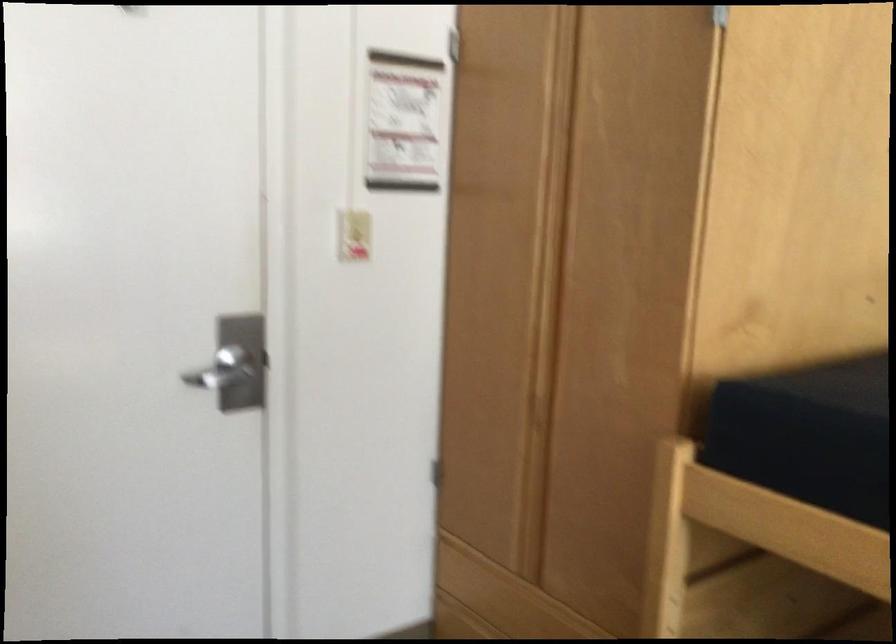
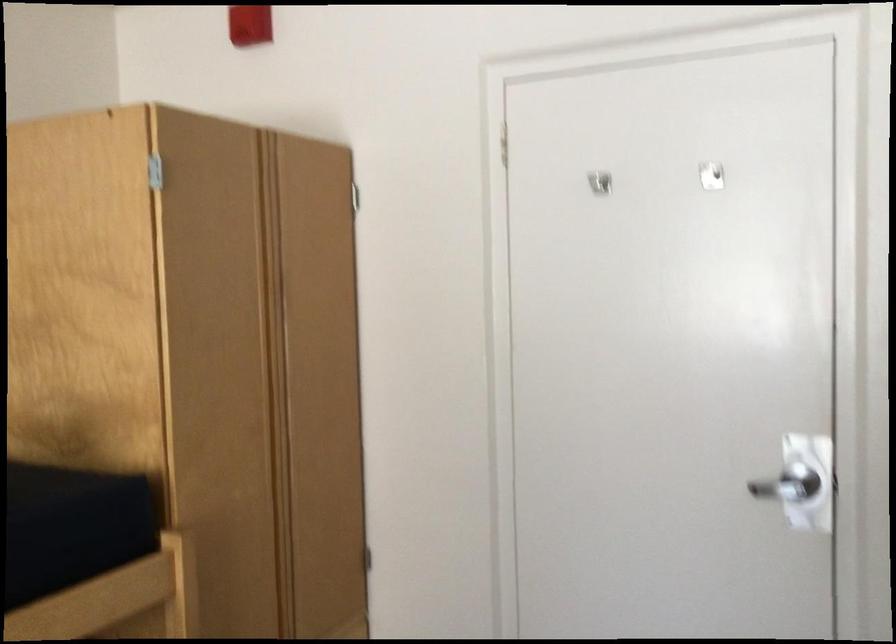
Where in the second image is the point corresponding to [222,361] from the first image?

(788, 484)